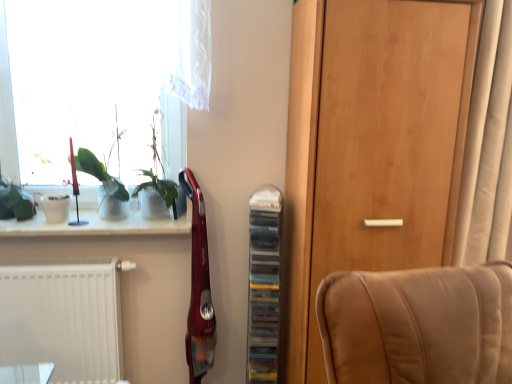
You are a GUI agent. You are given a task and a screenshot of the screen. Output one action in this format:
    pyautogui.click(x=<x>, y=<y>)
    Task: Click on the white matte radiator at lower left
    This screenshot has width=512, height=384.
    Given the screenshot: What is the action you would take?
    pyautogui.click(x=63, y=317)

Describe the element at coordinates (63, 317) in the screenshot. I see `white matte radiator at lower left` at that location.

The image size is (512, 384). What do you see at coordinates (370, 148) in the screenshot? I see `wooden door at center` at bounding box center [370, 148].

The image size is (512, 384). What do you see at coordinates (102, 185) in the screenshot? I see `green matte plant at left` at bounding box center [102, 185].

What do you see at coordinates (264, 284) in the screenshot?
I see `clear plastic shelf at center` at bounding box center [264, 284].

What do you see at coordinates (101, 75) in the screenshot? I see `transparent glass window at upper left` at bounding box center [101, 75].

You are a GUI agent. You are given a task and a screenshot of the screen. Output one action in this format:
    pyautogui.click(x=<x>, y=<y>)
    Task: Click on the transparent glass window at upper left
    The width and height of the screenshot is (512, 384).
    Given the screenshot: What is the action you would take?
    pyautogui.click(x=101, y=75)

Locate an element on the screen. white matte radiator at lower left is located at coordinates (63, 317).

Where is `houseplant that appears below the transparent glass window at upper left (from the image's perspective)`? The width and height of the screenshot is (512, 384). houseplant that appears below the transparent glass window at upper left (from the image's perspective) is located at coordinates (102, 185).

Which point is more forward, (23, 30) or (115, 209)?

Answer: The point (23, 30) is in front.

Is transparent glass window at upper left bigger or smaller than green matte plant at left?

transparent glass window at upper left is bigger than green matte plant at left.

Between wooden door at center and green leafy plant at upper left, which one has larger width?

wooden door at center is wider.

Is green leafy plant at upper left completely or partially inside wooden door at center?

No, green leafy plant at upper left is not surrounded by wooden door at center.

Looking at this image, can you see wooden door at center touching green leafy plant at upper left?

No, wooden door at center is not next to green leafy plant at upper left.

Which of these two, wooden door at center or white matte radiator at lower left, is bigger?

wooden door at center.

Can you tell me how much wooden door at center and white matte radiator at lower left differ in facing direction?

0.869 degrees separate the facing orientations of wooden door at center and white matte radiator at lower left.

Looking at this image, between wooden door at center and white matte radiator at lower left, which one has smaller width?

With smaller width is white matte radiator at lower left.

From the image's perspective, would you say wooden door at center is positioned over white matte radiator at lower left?

Indeed, from the image's perspective, wooden door at center is shown above white matte radiator at lower left.

In the scene shown: Is green matte plant at left taller than white matte radiator at lower left?

No, green matte plant at left is not taller than white matte radiator at lower left.

Does green matte plant at left turn towards white matte radiator at lower left?

No.

From a real-world perspective, between green matte plant at left and white matte radiator at lower left, who is vertically lower?

white matte radiator at lower left is physically lower.

Between point (125, 194) and point (36, 280), which one is positioned in front?

The point (36, 280) is in front.

Relative to beige fabric curtain at right, is wooden door at center in front or behind?

In the image, wooden door at center appears in front of beige fabric curtain at right.

In the scene shown: Is wooden door at center beside beige fabric curtain at right?

No, wooden door at center is not touching beige fabric curtain at right.

Is wooden door at center thinner than beige fabric curtain at right?

Incorrect, the width of wooden door at center is not less than that of beige fabric curtain at right.

How much distance is there between wooden door at center and beige fabric curtain at right?

A distance of 15.72 inches exists between wooden door at center and beige fabric curtain at right.

Looking at this image, can you confirm if green leafy plant at upper left is positioned to the left of beige fabric curtain at right?

Correct, you'll find green leafy plant at upper left to the left of beige fabric curtain at right.

From the image's perspective, which is below, green leafy plant at upper left or beige fabric curtain at right?

green leafy plant at upper left is shown below in the image.

Is point (175, 213) less distant than point (475, 146)?

No.

Is white matte radiator at lower left positioned far away from wooden door at center?

white matte radiator at lower left is positioned a significant distance from wooden door at center.

Locate an element on the screen. door above the white matte radiator at lower left (from the image's perspective) is located at coordinates (370, 148).

Considering the positions of objects white matte radiator at lower left and wooden door at center in the image provided, who is in front, white matte radiator at lower left or wooden door at center?

wooden door at center is in front.

Find the location of `window located in front of the green matte plant at left`. window located in front of the green matte plant at left is located at coordinates (101, 75).

Find the location of a particular element. The width and height of the screenshot is (512, 384). plant on the left side of wooden door at center is located at coordinates (157, 175).

Looking at this image, estimate the real-world distances between objects in this image. Which object is closer to clear plastic shelf at center, transparent glass window at upper left or white glossy window sill at upper left?

white glossy window sill at upper left.

Consider the image. From the image, which object appears to be nearer to clear plastic shelf at center, beige fabric curtain at right or white glossy window sill at upper left?

white glossy window sill at upper left is closer to clear plastic shelf at center.

Considering their positions, is clear plastic shelf at center positioned closer to white glossy window sill at upper left than wooden door at center?

clear plastic shelf at center is positioned closer to the anchor white glossy window sill at upper left.

Looking at this image, considering their positions, is green leafy plant at upper left positioned further to white glossy window sill at upper left than green matte plant at left?

green leafy plant at upper left.

In the scene shown: From the image, which object appears to be nearer to green leafy plant at upper left, transparent glass window at upper left or wooden door at center?

transparent glass window at upper left is positioned closer to the anchor green leafy plant at upper left.

Considering their positions, is white matte radiator at lower left positioned further to transparent glass window at upper left than green matte plant at left?

Among the two, white matte radiator at lower left is located further to transparent glass window at upper left.

From the image, which object appears to be nearer to wooden door at center, green leafy plant at upper left or white matte radiator at lower left?

Among the two, green leafy plant at upper left is located nearer to wooden door at center.

From the image, which object appears to be nearer to wooden door at center, green leafy plant at upper left or white glossy window sill at upper left?

Based on the image, white glossy window sill at upper left appears to be nearer to wooden door at center.

Where is `plant between green matte plant at left and beige fabric curtain at right in the horizontal direction`? The image size is (512, 384). plant between green matte plant at left and beige fabric curtain at right in the horizontal direction is located at coordinates pyautogui.click(x=157, y=175).

Locate an element on the screen. houseplant located between white matte radiator at lower left and beige fabric curtain at right in the left-right direction is located at coordinates (102, 185).

Identify the location of window between white matte radiator at lower left and wooden door at center. click(101, 75).

Find the location of a particular element. window situated between white matte radiator at lower left and beige fabric curtain at right from left to right is located at coordinates (101, 75).